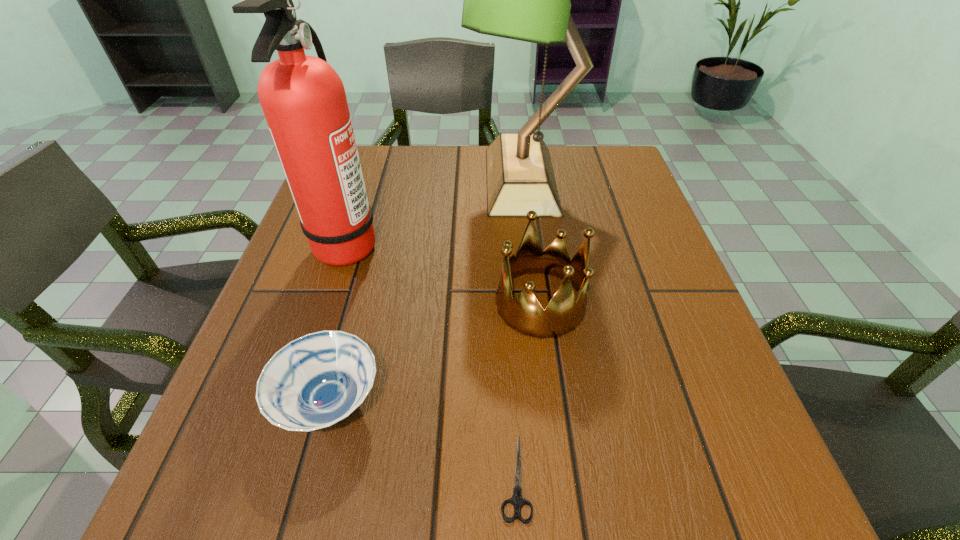
I want to click on vacant space located 0.060m on the front of the soup bowl, so click(x=303, y=502).

You are a GUI agent. You are given a task and a screenshot of the screen. Output one action in this format:
    pyautogui.click(x=<x>, y=<y>)
    Task: Click on the free space located 0.200m on the back of the shortest object
    The height and width of the screenshot is (540, 960).
    Given the screenshot: What is the action you would take?
    pyautogui.click(x=507, y=327)

This screenshot has height=540, width=960. Identify the location of object at the far edge. (528, 0).

At what (x,y) coordinates should I click in order to perform the action: click on object that is at the near edge. Please return your answer as a coordinate pair (x, y). Looking at the image, I should click on (517, 500).

You are a GUI agent. You are given a task and a screenshot of the screen. Output one action in this format:
    pyautogui.click(x=<x>, y=<y>)
    Task: Click on the fire extinguisher that is at the left edge
    
    Given the screenshot: What is the action you would take?
    pyautogui.click(x=303, y=99)

Where is `soup bowl that is positioned at the left edge`? soup bowl that is positioned at the left edge is located at coordinates (315, 381).

Where is `object at the right edge`? Image resolution: width=960 pixels, height=540 pixels. object at the right edge is located at coordinates (528, 0).

At what (x,y) coordinates should I click in order to perform the action: click on object at the far right corner. Please return your answer as a coordinate pair (x, y). Looking at the image, I should click on (528, 0).

The image size is (960, 540). I want to click on vacant space at the far edge, so click(x=444, y=153).

Where is `free space at the near edge of the desktop`? Image resolution: width=960 pixels, height=540 pixels. free space at the near edge of the desktop is located at coordinates (451, 478).